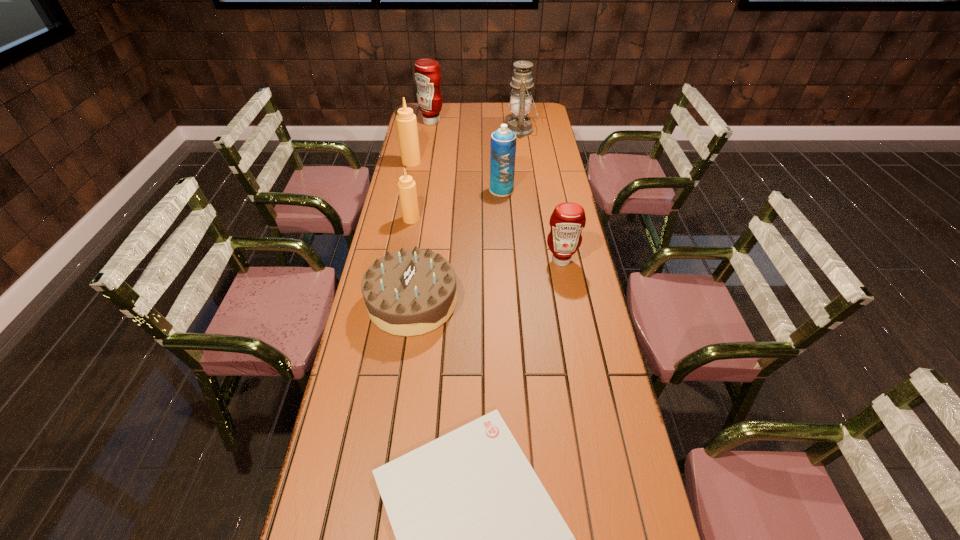
Image resolution: width=960 pixels, height=540 pixels. In order to click on vacant space that's between the birthday cake and the oil lamp in this screenshot , I will do `click(467, 216)`.

Where is `free space between the bigger tan condiment and the oil lamp`? free space between the bigger tan condiment and the oil lamp is located at coordinates (466, 146).

The image size is (960, 540). What are the coordinates of `vacant area that lies between the second farthest condiment and the seventh farthest object` in the screenshot? It's located at (412, 232).

The height and width of the screenshot is (540, 960). I want to click on object that can be found as the third closest to the shortest object, so tap(406, 186).

At what (x,y) coordinates should I click in order to perform the action: click on object that can be found as the sixth closest to the shortest object. Please return your answer as a coordinate pair (x, y). The image size is (960, 540). Looking at the image, I should click on (520, 102).

Locate an element on the screen. the third closest condiment to the seventh farthest object is located at coordinates (406, 121).

The width and height of the screenshot is (960, 540). I want to click on condiment that stands as the second closest to the fourth farthest object, so click(x=406, y=121).

Identify the location of free space that satisfies the following two spatial constraints: 1. on the front side of the sixth farthest object; 2. on the left side of the oil lamp. (539, 260).

Find the location of `free space that satisfies the following two spatial constraints: 1. on the back side of the fourth farthest object; 2. on the left side of the oil lamp`. free space that satisfies the following two spatial constraints: 1. on the back side of the fourth farthest object; 2. on the left side of the oil lamp is located at coordinates (498, 130).

The height and width of the screenshot is (540, 960). I want to click on free space that satisfies the following two spatial constraints: 1. on the front side of the left red condiment; 2. on the right side of the rightmost condiment, so [408, 260].